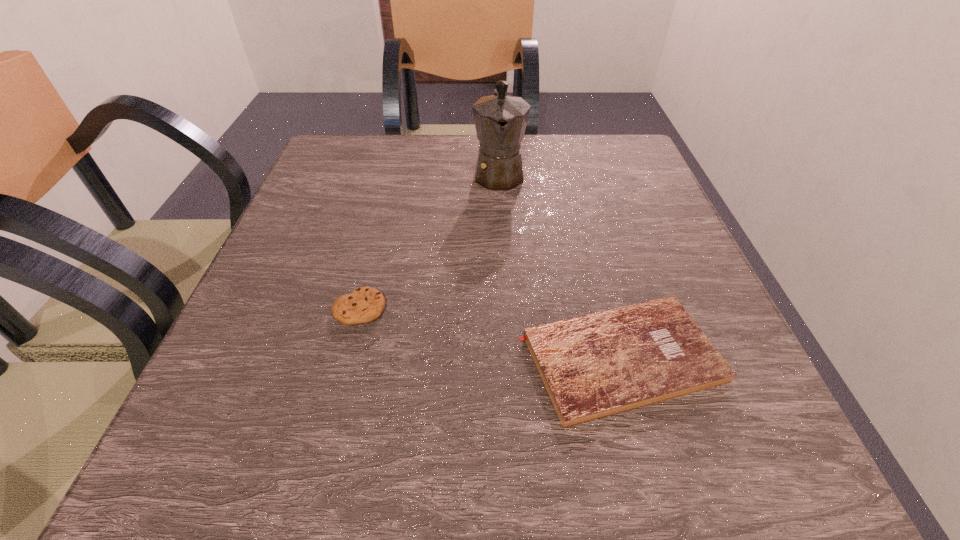
This screenshot has height=540, width=960. What are the coordinates of `object at the right edge` in the screenshot? It's located at (593, 366).

This screenshot has width=960, height=540. What are the coordinates of `object that is at the near right corner` in the screenshot? It's located at pyautogui.click(x=593, y=366).

Find the location of `vacant space at the far edge`. vacant space at the far edge is located at coordinates (431, 174).

Find the location of `vacant space at the near edge of the desktop`. vacant space at the near edge of the desktop is located at coordinates (377, 451).

Locate an element on the screen. free space at the left edge is located at coordinates (329, 356).

At what (x,y) coordinates should I click in order to perform the action: click on vacant space at the right edge of the desktop. Please return your answer as a coordinate pair (x, y). The width and height of the screenshot is (960, 540). Looking at the image, I should click on (687, 253).

Find the location of a particular element. Image resolution: width=960 pixels, height=540 pixels. vacant space at the far left corner of the desktop is located at coordinates (322, 165).

The width and height of the screenshot is (960, 540). I want to click on free space at the far right corner of the desktop, so click(x=611, y=189).

The width and height of the screenshot is (960, 540). I want to click on free space that is in between the farthest object and the Bible, so click(x=560, y=266).

Find the location of a particular element. The width and height of the screenshot is (960, 540). unoccupied area between the coffeepot and the Bible is located at coordinates (560, 266).